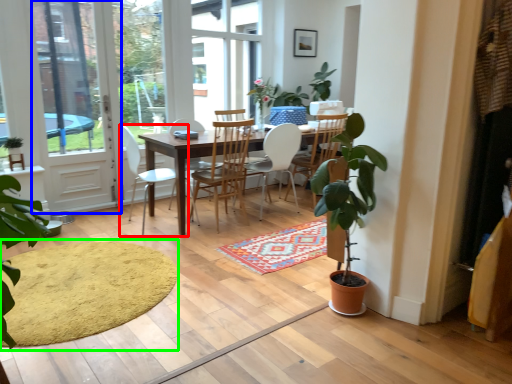
Question: Which is farther away from chair (highlighted by a red box)? screen door (highlighted by a blue box) or doormat (highlighted by a green box)?

Choices:
 (A) screen door
 (B) doormat

Answer: (B)